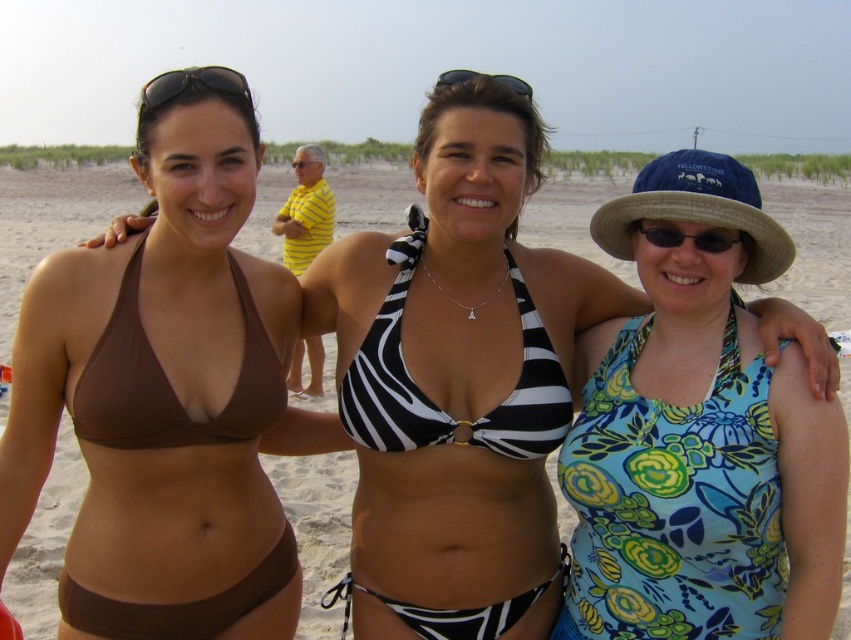
Question: Is floral print fabric bikini top at right wider than yellow striped polo shirt at center?

Choices:
 (A) yes
 (B) no

Answer: (B)

Question: Does brown matte bikini top at left have a greater width compared to yellow striped polo shirt at center?

Choices:
 (A) yes
 (B) no

Answer: (B)

Question: Which object is positioned closest to the black plastic sunglasses at center?

Choices:
 (A) black and white striped bikini top at center
 (B) floral print fabric bikini top at right

Answer: (A)

Question: Is black and white striped bikini top at center bigger than yellow striped polo shirt at center?

Choices:
 (A) no
 (B) yes

Answer: (A)

Question: Which object is closer to the camera taking this photo?

Choices:
 (A) yellow striped polo shirt at center
 (B) black plastic sunglasses at center

Answer: (A)

Question: Among these points, which one is farthest from the camera?

Choices:
 (A) (189, 596)
 (B) (480, 444)

Answer: (B)